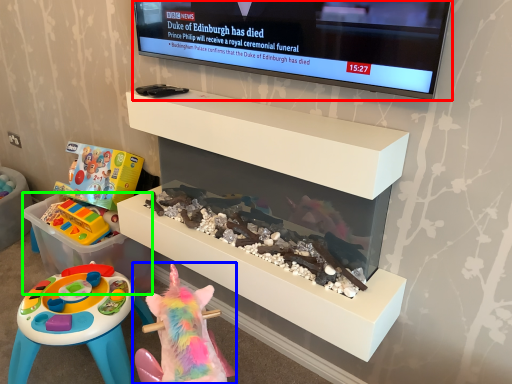
Question: Which object is positioned closest to television (highlighted by a red box)? Select from toy (highlighted by a blue box) and storage box (highlighted by a green box).

Choices:
 (A) toy
 (B) storage box

Answer: (A)